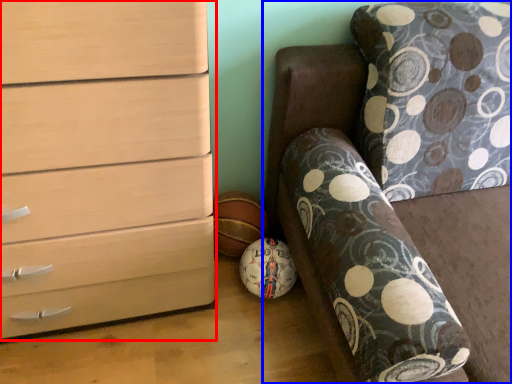
Question: Which point is closer to the camera, chest of drawers (highlighted by a red box) or furniture (highlighted by a blue box)?

Choices:
 (A) chest of drawers
 (B) furniture

Answer: (B)